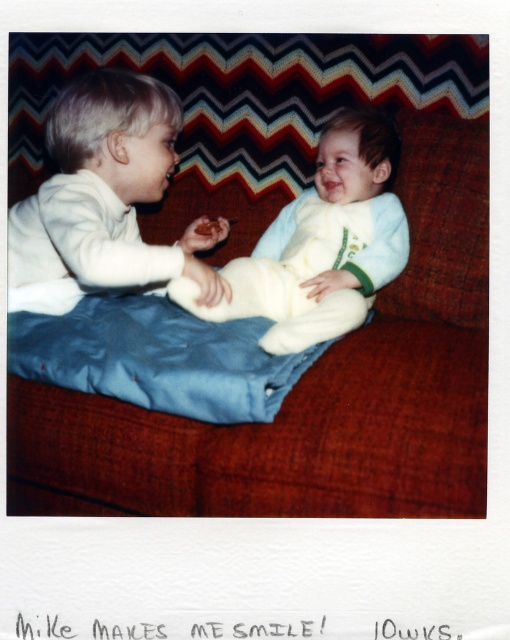
You are a photographer setting up for a family photo. You need to position a small stool between the matte white shirt at left and the light blue fleece onesie at center so that both children can sit comfortably. Based on their sizes, where should you place the stool?

Since the matte white shirt at left might be wider than light blue fleece onesie at center, the stool should be placed closer to the light blue fleece onesie at center to accommodate the wider space needed for the older child in the matte white shirt at left.

You are a photographer taking a picture of the two children on the couch. You notice a point at coordinates (104, 198) in the image. What object is located at that point?

The point at coordinates (104, 198) marks the matte white shirt at left.

You are a photographer taking a photo of the scene. The camera is focused on the light blue fleece onesie at center. Where should you adjust the focus to capture the older child offering the snack?

The light blue fleece onesie at center is at point (321, 243), so you should adjust the focus to a position closer to the older child who is holding the snack, which is not at the given coordinates of the onesie.